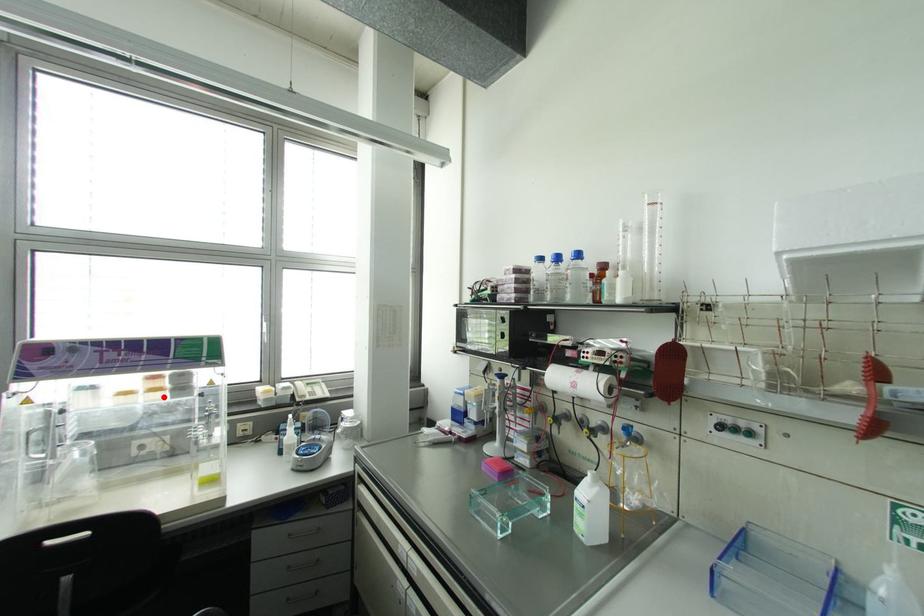
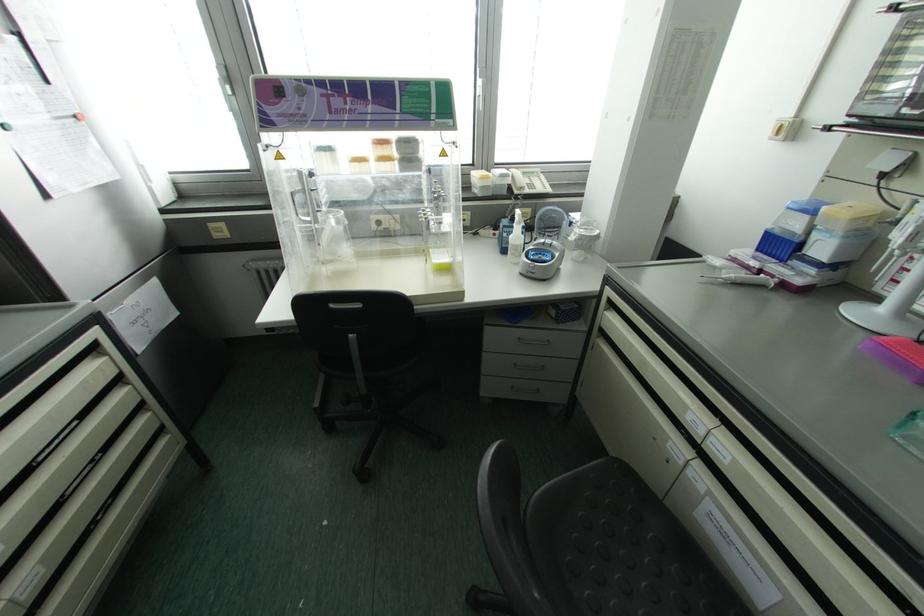
The point at the highlighted location is marked in the first image. Where is the corresponding point in the second image?

(393, 169)